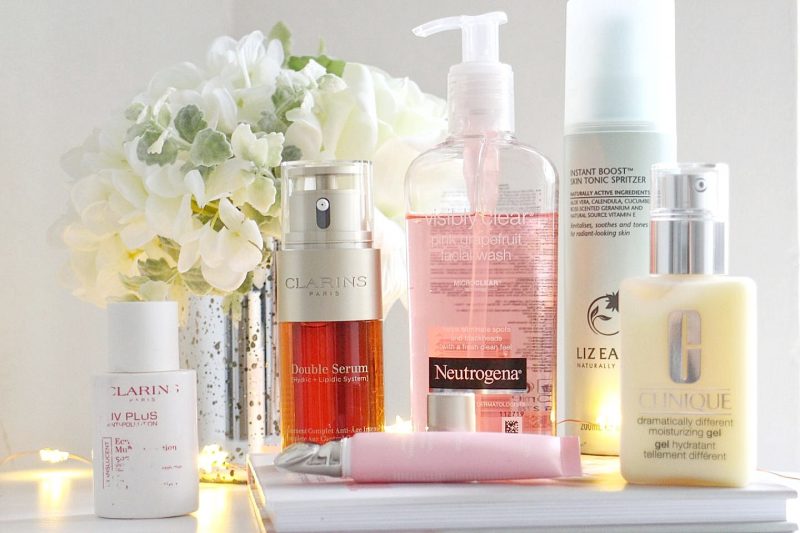
Locate an element on the screen. This screenshot has width=800, height=533. vase is located at coordinates (248, 339).